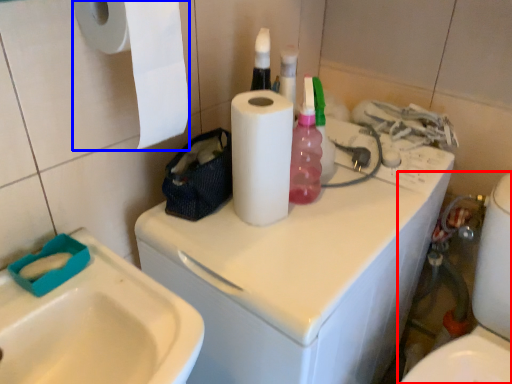
Question: Which object is closer to the camera taking this photo, toilet (highlighted by a red box) or paper towel (highlighted by a blue box)?

Choices:
 (A) toilet
 (B) paper towel

Answer: (B)